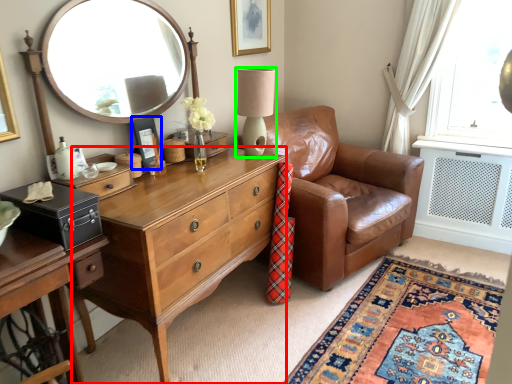
Question: Which is nearer to the desk (highlighted by a red box)? picture frame (highlighted by a blue box) or table lamp (highlighted by a green box).

Choices:
 (A) picture frame
 (B) table lamp

Answer: (A)